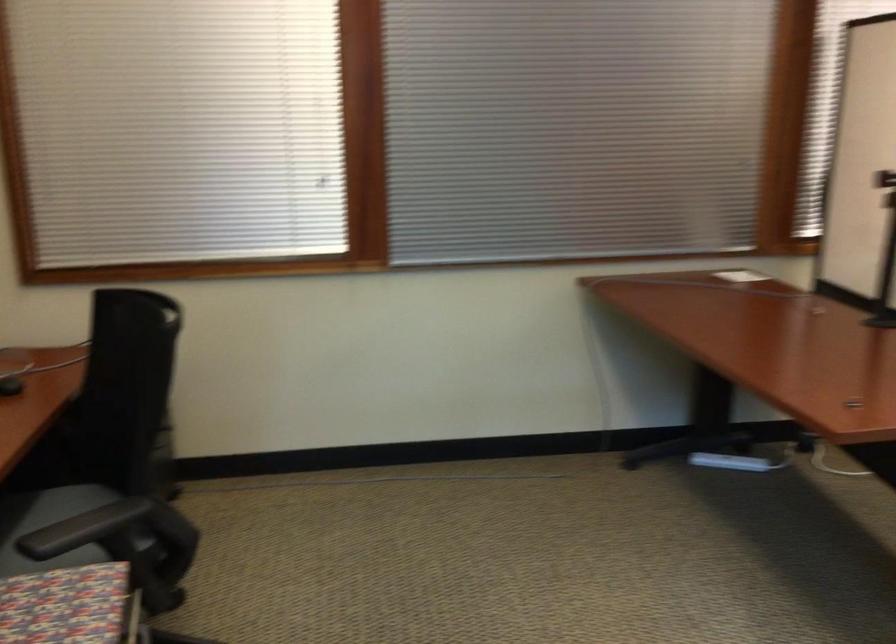
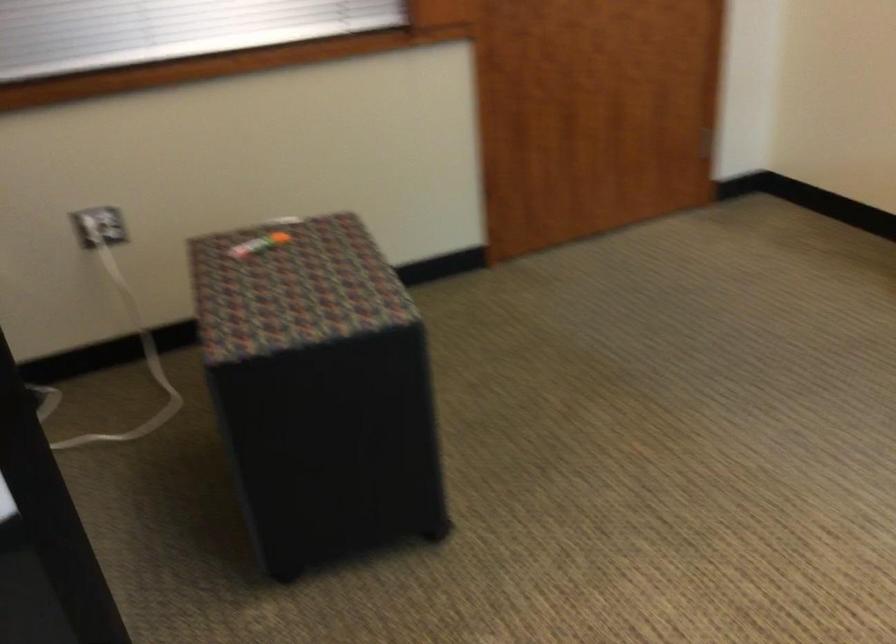
Question: In a continuous first-person perspective shot, in which direction is the camera moving?

Choices:
 (A) Left
 (B) Right
 (C) Forward
 (D) Backward

Answer: (B)